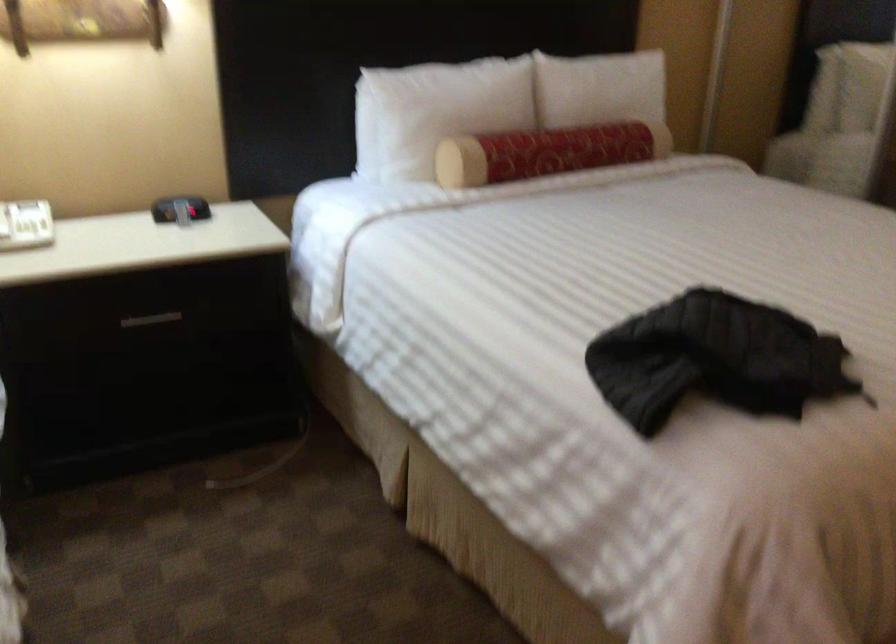
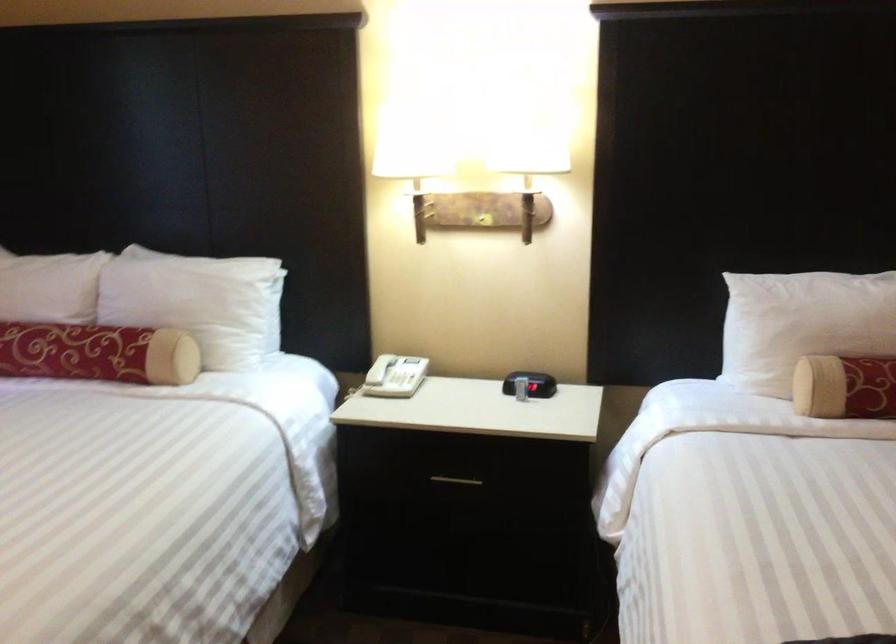
Where in the second image is the point corresponding to pixel 151 322 from the first image?

(455, 480)